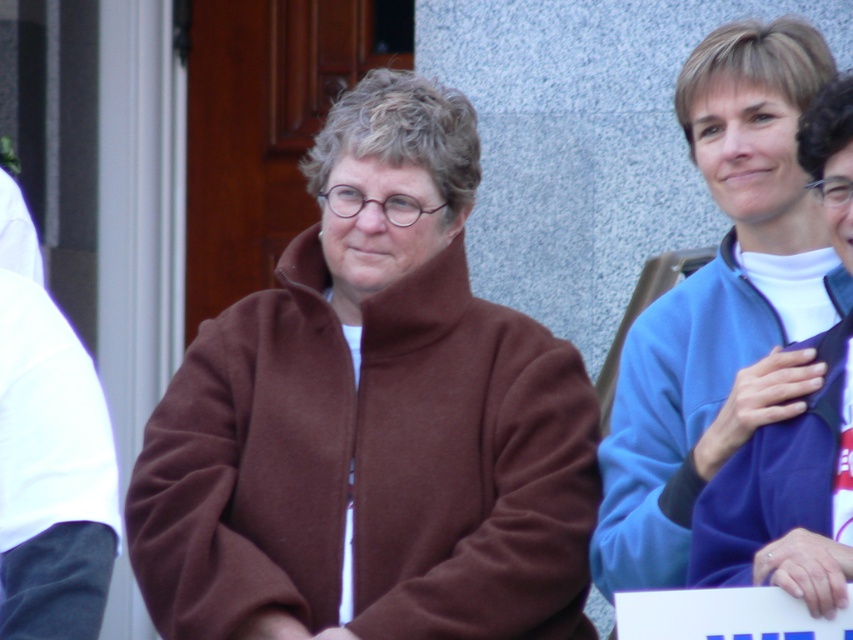
Question: Which is nearer to the blue fleece jacket at right?

Choices:
 (A) white fabric at left
 (B) brown fleece jacket at center

Answer: (B)

Question: Does blue fleece jacket at right appear over white fabric at left?

Choices:
 (A) no
 (B) yes

Answer: (B)

Question: Can you confirm if brown fleece jacket at center is smaller than white fabric at left?

Choices:
 (A) no
 (B) yes

Answer: (A)

Question: Which point appears closest to the camera in this image?

Choices:
 (A) (48, 467)
 (B) (585, 540)
 (C) (747, 195)

Answer: (A)

Question: Does blue fleece jacket at right appear over white fabric at left?

Choices:
 (A) no
 (B) yes

Answer: (B)

Question: Which of these objects is positioned farthest from the blue fleece jacket at right?

Choices:
 (A) white fabric at left
 (B) brown fleece jacket at center

Answer: (A)